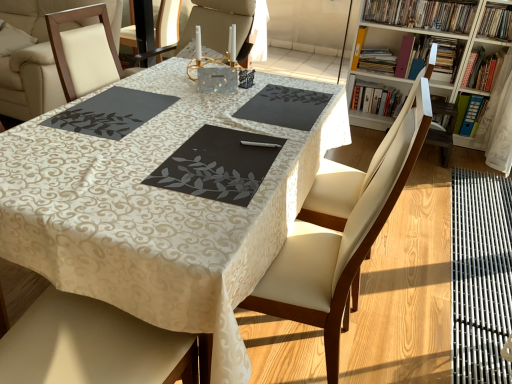
Where is `free point above hardcover books at upper right, the 7th book from the right (from a real-world perspective)`? The width and height of the screenshot is (512, 384). free point above hardcover books at upper right, the 7th book from the right (from a real-world perspective) is located at coordinates (379, 86).